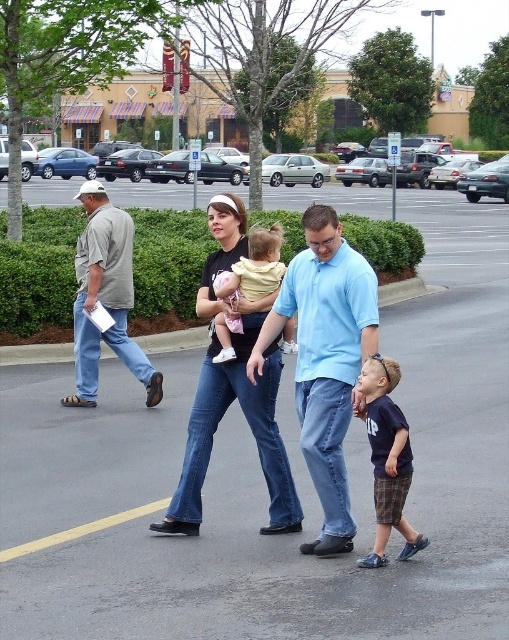
Question: Is light blue cotton shirt at center in front of yellow cotton shirt at center?

Choices:
 (A) yes
 (B) no

Answer: (A)

Question: Which of the following is the farthest from the observer?

Choices:
 (A) (391, 456)
 (B) (342, 276)
 (C) (209, 205)

Answer: (C)

Question: Which of the following is the closest to the observer?

Choices:
 (A) (387, 371)
 (B) (213, 257)

Answer: (A)

Question: Is light blue cotton shirt at center to the left of yellow cotton shirt at center from the viewer's perspective?

Choices:
 (A) no
 (B) yes

Answer: (A)

Question: Which of the following is the closest to the observer?

Choices:
 (A) (382, 408)
 (B) (238, 268)
 (C) (100, 202)

Answer: (A)

Question: Observing the image, what is the correct spatial positioning of light blue cotton shirt at center in reference to navy blue t-shirt at center?

Choices:
 (A) above
 (B) below

Answer: (A)